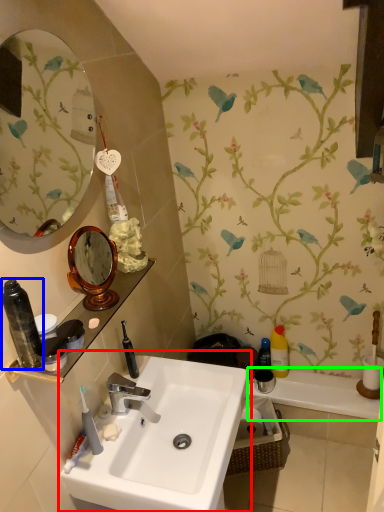
Question: Considering the real-world distances, which object is farthest from sink (highlighted by a red box)? toiletry (highlighted by a blue box) or bath (highlighted by a green box)?

Choices:
 (A) toiletry
 (B) bath

Answer: (B)